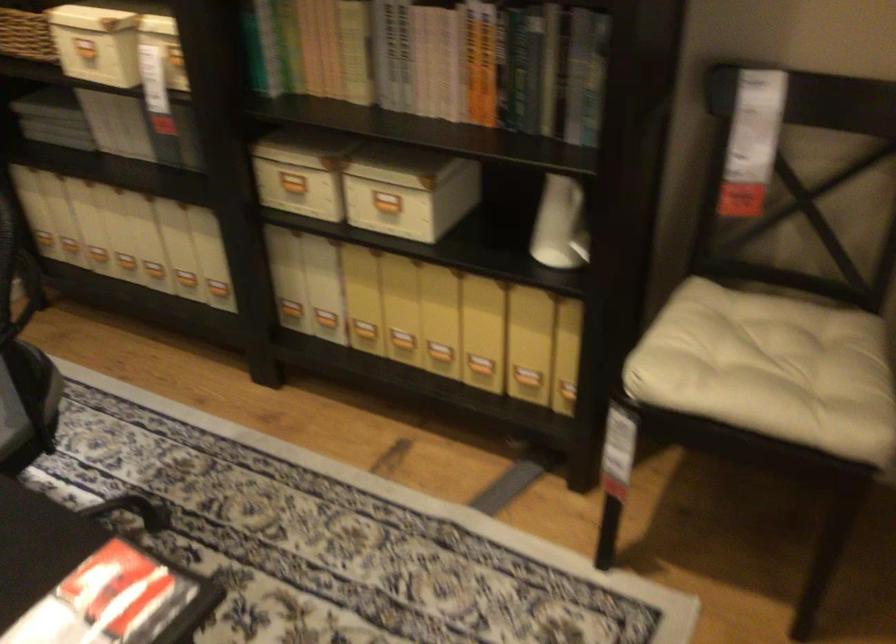
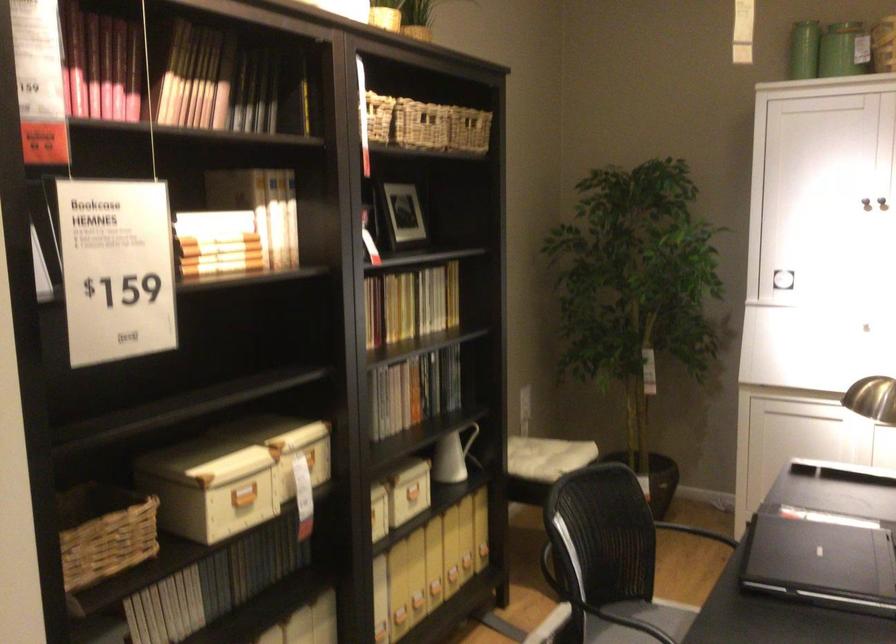
Find the pixel in the second image that matches (x=437, y=212) in the first image.

(418, 491)